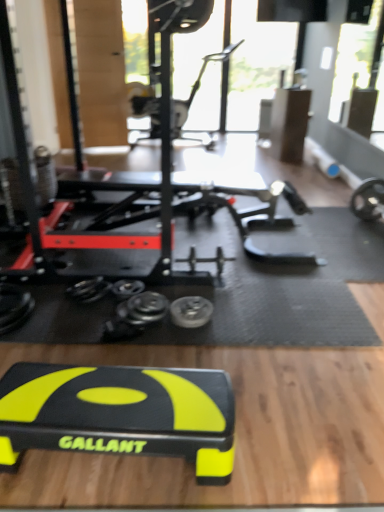
Image resolution: width=384 pixels, height=512 pixels. In order to click on spots to the right of black rubber step platform at center, which is the second sport equipment in back-to-front order in this screenshot , I will do `click(280, 425)`.